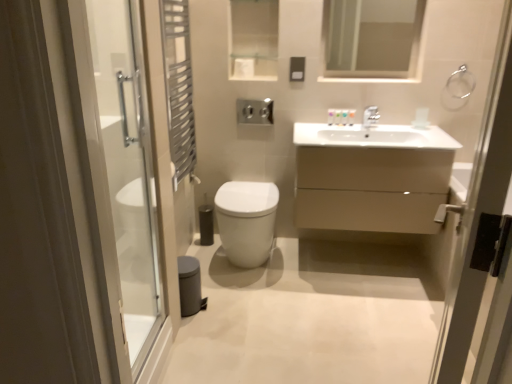
Identify the location of vacant space to the left of satin nickel faucet at upper center. (339, 127).